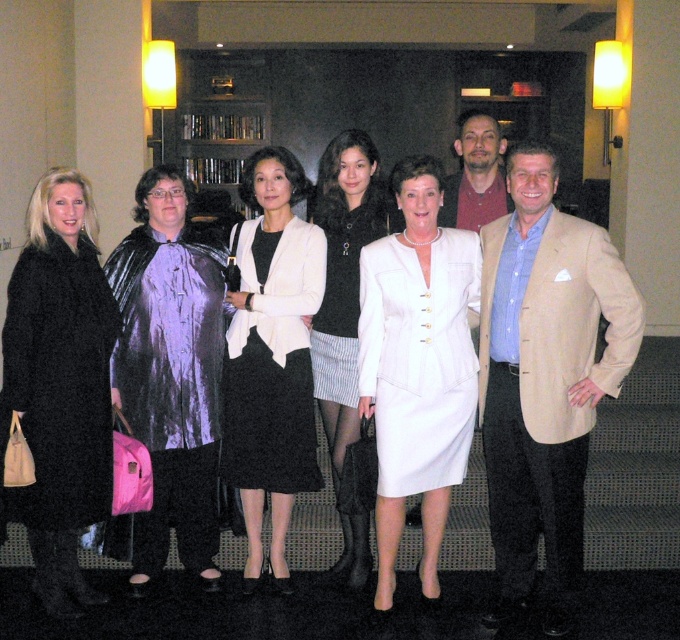
Which is below, white satin dress at center or white textured dress at center?

white satin dress at center is lower down.

In the scene shown: Who is more distant from viewer, (x=347, y=380) or (x=357, y=292)?

The point (x=357, y=292) is more distant.

Identify the location of white satin dress at center. (345, 314).

This screenshot has width=680, height=640. Identify the location of white satin dress at center. (345, 314).

Who is more distant from viewer, (136, 550) or (466, 147)?

Positioned behind is point (466, 147).

Does metallic purple cape at center appear on the left side of matte brown jacket at center?

Indeed, metallic purple cape at center is positioned on the left side of matte brown jacket at center.

Find the location of a particular element. This screenshot has height=640, width=680. metallic purple cape at center is located at coordinates (171, 371).

Does matte white blazer at center appear on the right side of matte brown jacket at center?

In fact, matte white blazer at center is to the left of matte brown jacket at center.

What do you see at coordinates (272, 355) in the screenshot? I see `matte white blazer at center` at bounding box center [272, 355].

This screenshot has width=680, height=640. Describe the element at coordinates (272, 355) in the screenshot. I see `matte white blazer at center` at that location.

The height and width of the screenshot is (640, 680). I want to click on matte white blazer at center, so click(x=272, y=355).